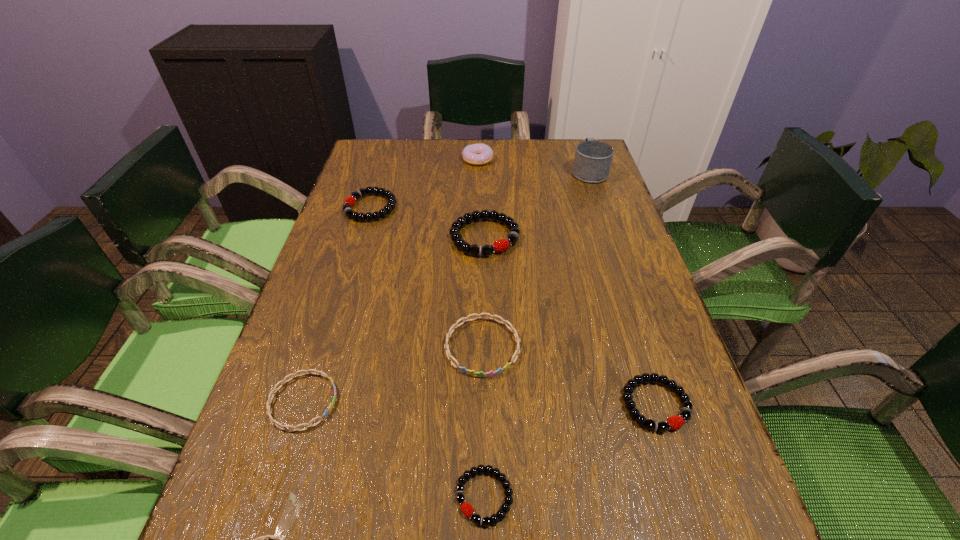
Find the location of a particular element. mug is located at coordinates (x=593, y=159).

Identify the location of doughnut. tap(475, 154).

Find the location of `the tallest bracelet`. the tallest bracelet is located at coordinates (501, 245).

You are a GUI agent. You are given a task and a screenshot of the screen. Output one action in this format:
    pyautogui.click(x=<x>, y=<y>)
    Task: Click on the biggest black bracelet
    
    Given the screenshot: What is the action you would take?
    pyautogui.click(x=501, y=245)

Identify the location of the second biggest black bracelet. This screenshot has height=540, width=960. coord(350,201).

You are a GUI agent. You are given a task and a screenshot of the screen. Output one action in this format:
    pyautogui.click(x=<x>, y=<y>)
    Task: Click on the biggest blue bracelet
    
    Given the screenshot: What is the action you would take?
    pyautogui.click(x=471, y=372)

Find the location of a particular element. the second smallest black bracelet is located at coordinates (674, 422).

This screenshot has width=960, height=540. I want to click on the second nearest black bracelet, so [x=674, y=422].

This screenshot has width=960, height=540. I want to click on the second smallest blue bracelet, so click(282, 427).

Identify the location of the second nearest object. (466, 508).